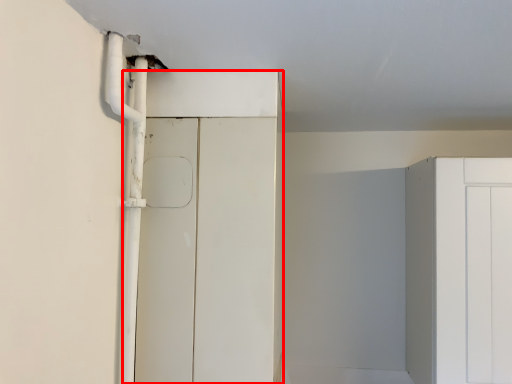
Question: Considering the relative positions of door (annotated by the red box) and pipe in the image provided, where is door (annotated by the red box) located with respect to the staircase?

Choices:
 (A) left
 (B) right

Answer: (B)